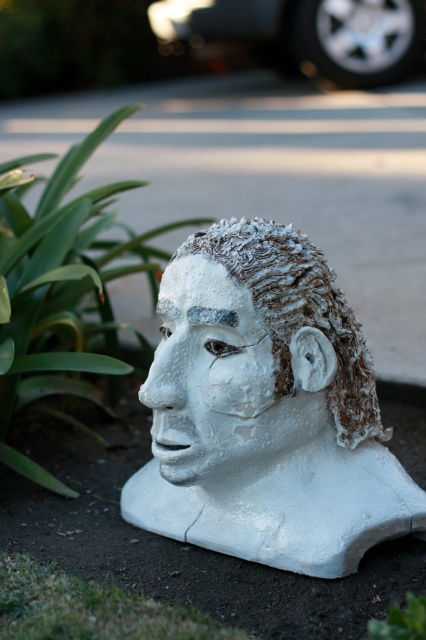
You are an artist observing the white matte bust at center and the green leafy plant at lower left in the image. Which object is taller?

The green leafy plant at lower left is taller than the white matte bust at center.

You are an artist trying to place a new sculpture in your outdoor exhibition. You have a white matte bust at center and a green leafy plant at lower left. If you want to arrange them side by side with equal spacing between them, which object should be placed closer to the edge of the display area to maintain balance?

The white matte bust at center should be placed closer to the edge of the display area because its width is less than the green leafy plant at lower left, so to balance the arrangement, the smaller object needs to be positioned closer to the edge while the larger one stays further back.

You are a delivery person who needs to place a small package between the white frosted bust at center and the green leafy plant at lower right. The package is 15 inches long. Will it fit in the space between them?

The white frosted bust at center and green leafy plant at lower right are 17.74 inches apart. Since the package is 15 inches long, it will fit in the space between them as there is enough room.